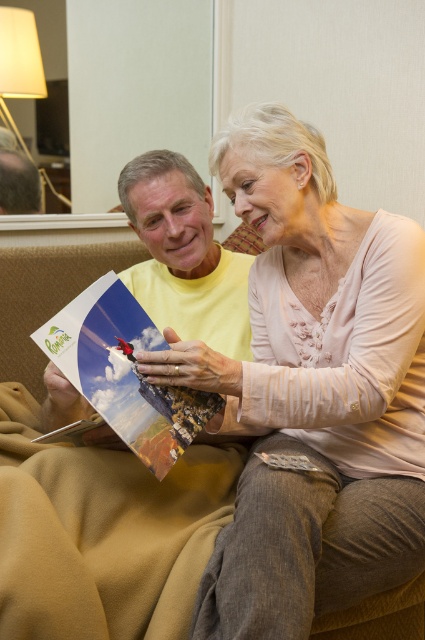
Is matte paper postcard at center positioned in front of matte yellow shirt at upper center?

Yes.

Is matte paper postcard at center bigger than matte yellow shirt at upper center?

Correct, matte paper postcard at center is larger in size than matte yellow shirt at upper center.

Does point (110, 371) come farther from viewer compared to point (0, 184)?

No, it is in front of (0, 184).

Locate an element on the screen. matte paper postcard at center is located at coordinates (124, 372).